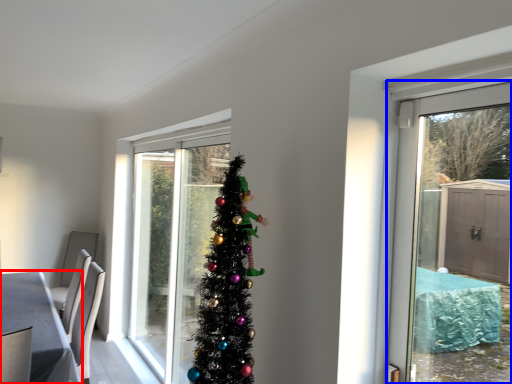
Question: Which object is closer to the camera taking this photo, table (highlighted by a red box) or door (highlighted by a blue box)?

Choices:
 (A) table
 (B) door

Answer: (B)